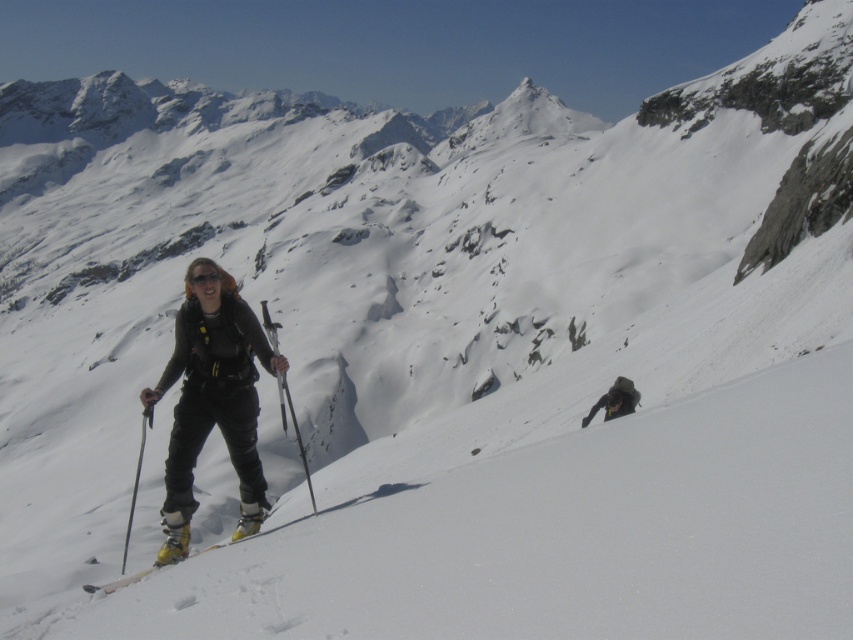
You are a photographer trying to capture the skier and their equipment in the snowy landscape. Based on the scene, which object is positioned higher up the slope between the matte black ski pole at center and the yellow matte ski at center?

The matte black ski pole at center is located above the yellow matte ski at center, so it is positioned higher up the slope.